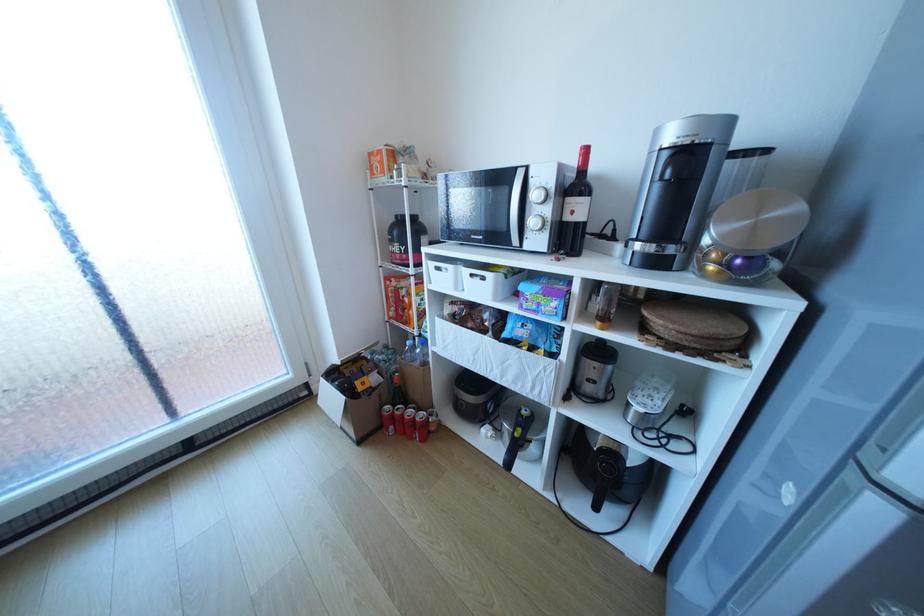
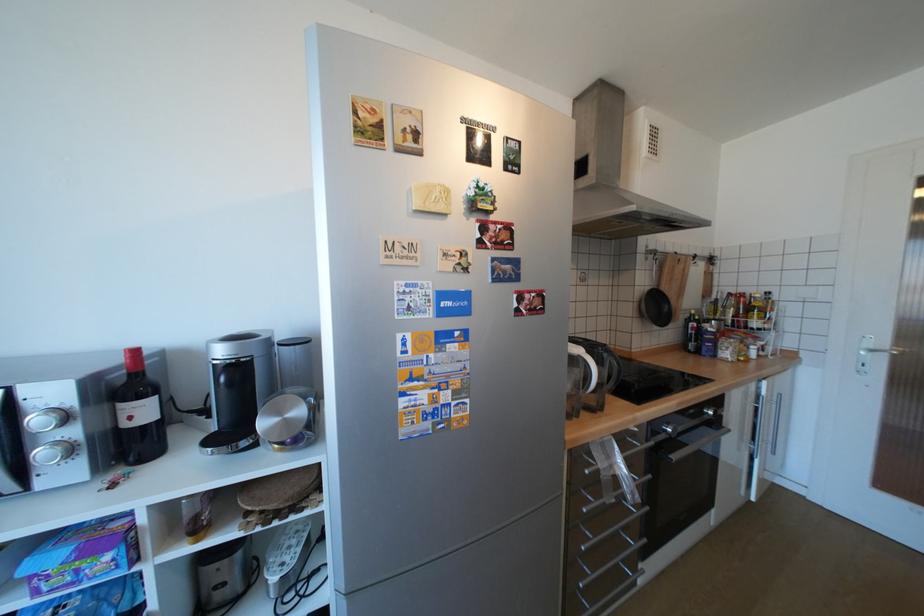
Question: I am providing you with two images of the same scene from different viewpoints. After the viewpoint changes to image2, which objects are now occluded?

Choices:
 (A) silver microwave knob
 (B) silver coffee machine lid
 (C) capsule holder lid
 (D) none of these

Answer: (D)